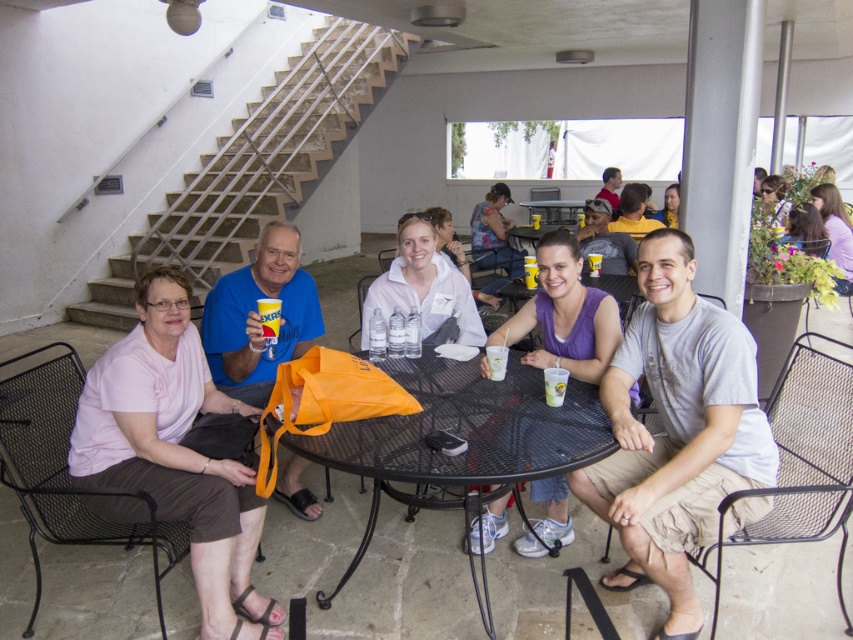
Is the position of gray cotton shirt at center less distant than that of purple fabric tank top at center?

Yes, gray cotton shirt at center is in front of purple fabric tank top at center.

Is point (715, 332) positioned in front of point (572, 372)?

Yes, point (715, 332) is closer to viewer.

Which is behind, point (602, 378) or point (563, 476)?

Positioned behind is point (563, 476).

Identify the location of gray cotton shirt at center. This screenshot has width=853, height=640. (676, 428).

Is orange fabric bag at center closer to the viewer compared to purple fabric tank top at center?

No, orange fabric bag at center is behind purple fabric tank top at center.

Is orange fabric bag at center thinner than purple fabric tank top at center?

Yes.

Locate an element on the screen. This screenshot has width=853, height=640. orange fabric bag at center is located at coordinates (258, 316).

This screenshot has height=640, width=853. I want to click on orange fabric bag at center, so click(258, 316).

The image size is (853, 640). What do you see at coordinates (676, 428) in the screenshot?
I see `gray cotton shirt at center` at bounding box center [676, 428].

Between gray cotton shirt at center and black mesh table at center, which one is positioned higher?

Positioned higher is black mesh table at center.

Locate an element on the screen. This screenshot has width=853, height=640. gray cotton shirt at center is located at coordinates (676, 428).